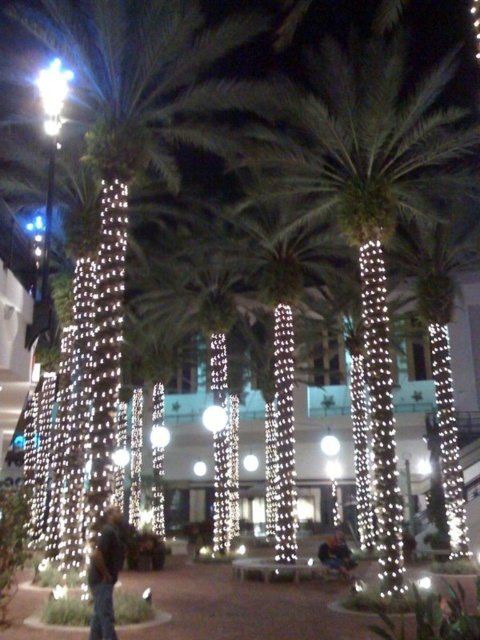
You are standing in the plaza and want to place a small bench between the green leafy palm tree at center and the illuminated string lights at center. Can you fit the bench there?

The green leafy palm tree at center might be wider than the illuminated string lights at center, so there might not be enough space to fit the bench between them.

You are standing in the plaza and want to take a photo of the green leafy palm tree at center and the illuminated string lights at center. Which object will appear larger in your photo?

The green leafy palm tree at center will appear larger in the photo because it is closer to you than the illuminated string lights at center.